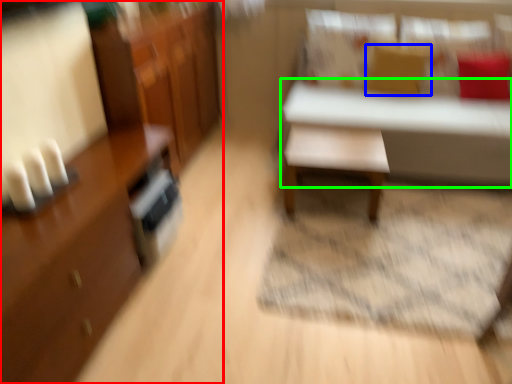
Question: Which is farther away from cabinetry (highlighted by a red box)? pillow (highlighted by a blue box) or table (highlighted by a green box)?

Choices:
 (A) pillow
 (B) table

Answer: (A)